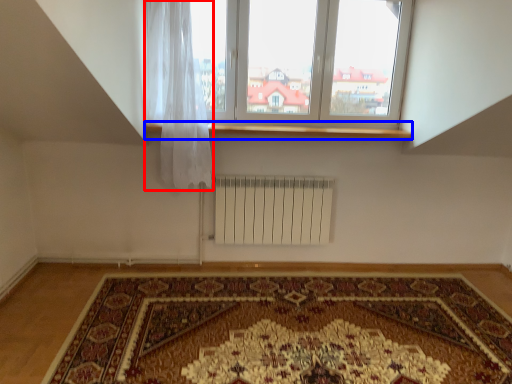
Question: Which object is further to the camera taking this photo, curtain (highlighted by a red box) or window sill (highlighted by a blue box)?

Choices:
 (A) curtain
 (B) window sill

Answer: (B)